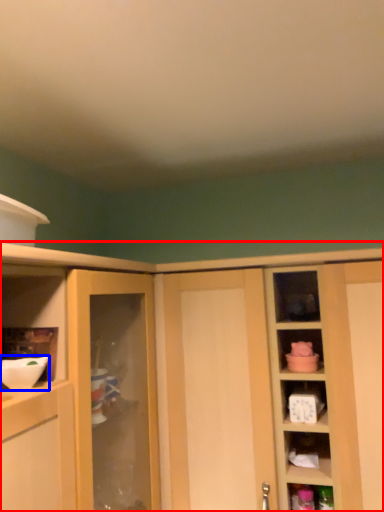
Question: Among these objects, which one is farthest to the camera, cabinetry (highlighted by a red box) or mixing bowl (highlighted by a blue box)?

Choices:
 (A) cabinetry
 (B) mixing bowl

Answer: (A)